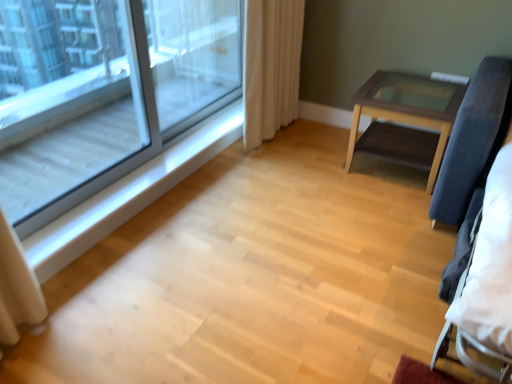
Question: From a real-world perspective, is transparent glass screen door at upper left on top of clear glass window at upper left?

Choices:
 (A) yes
 (B) no

Answer: (B)

Question: Is transparent glass screen door at upper left not near clear glass window at upper left?

Choices:
 (A) yes
 (B) no

Answer: (B)

Question: Does transparent glass screen door at upper left turn towards clear glass window at upper left?

Choices:
 (A) yes
 (B) no

Answer: (A)

Question: Is clear glass window at upper left inside transparent glass screen door at upper left?

Choices:
 (A) no
 (B) yes

Answer: (A)

Question: From the image's perspective, would you say transparent glass screen door at upper left is shown under clear glass window at upper left?

Choices:
 (A) yes
 (B) no

Answer: (B)

Question: In the image, is transparent glass screen door at upper left positioned in front of or behind beige fabric curtain at upper right?

Choices:
 (A) behind
 (B) front

Answer: (B)

Question: Is transparent glass screen door at upper left bigger or smaller than beige fabric curtain at upper right?

Choices:
 (A) small
 (B) big

Answer: (A)

Question: From the image's perspective, is transparent glass screen door at upper left positioned above or below beige fabric curtain at upper right?

Choices:
 (A) above
 (B) below

Answer: (B)

Question: Is transparent glass screen door at upper left inside the boundaries of beige fabric curtain at upper right, or outside?

Choices:
 (A) inside
 (B) outside

Answer: (B)

Question: From the image's perspective, is white wood at left above or below wooden glass-top table at right?

Choices:
 (A) above
 (B) below

Answer: (B)

Question: Is point (44, 269) positioned closer to the camera than point (410, 77)?

Choices:
 (A) farther
 (B) closer

Answer: (B)

Question: Is white wood at left wider or thinner than wooden glass-top table at right?

Choices:
 (A) wide
 (B) thin

Answer: (B)

Question: Would you say white wood at left is inside or outside wooden glass-top table at right?

Choices:
 (A) outside
 (B) inside

Answer: (A)

Question: Would you say white wood at left is inside or outside beige fabric curtain at upper right?

Choices:
 (A) inside
 (B) outside

Answer: (B)

Question: From a real-world perspective, relative to beige fabric curtain at upper right, is white wood at left vertically above or below?

Choices:
 (A) above
 (B) below

Answer: (B)